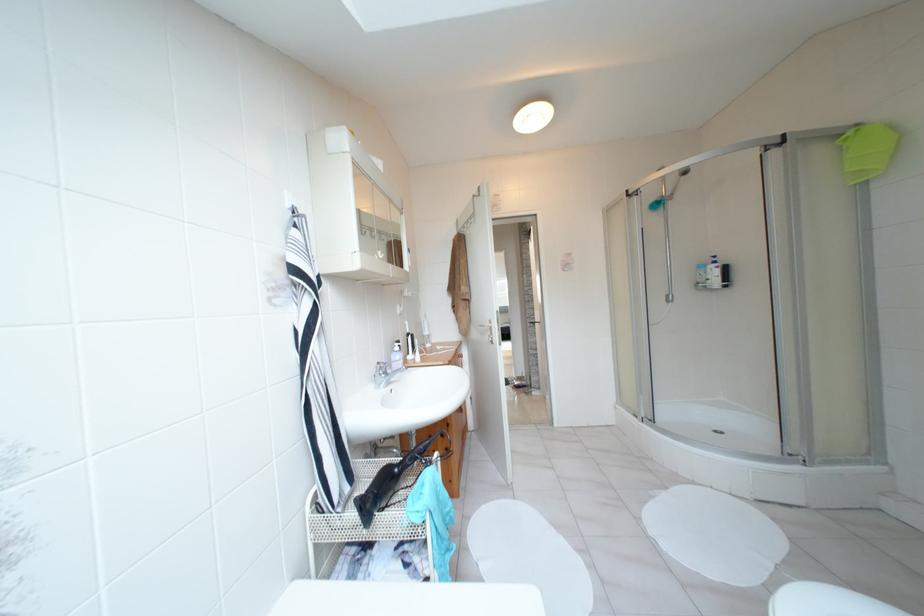
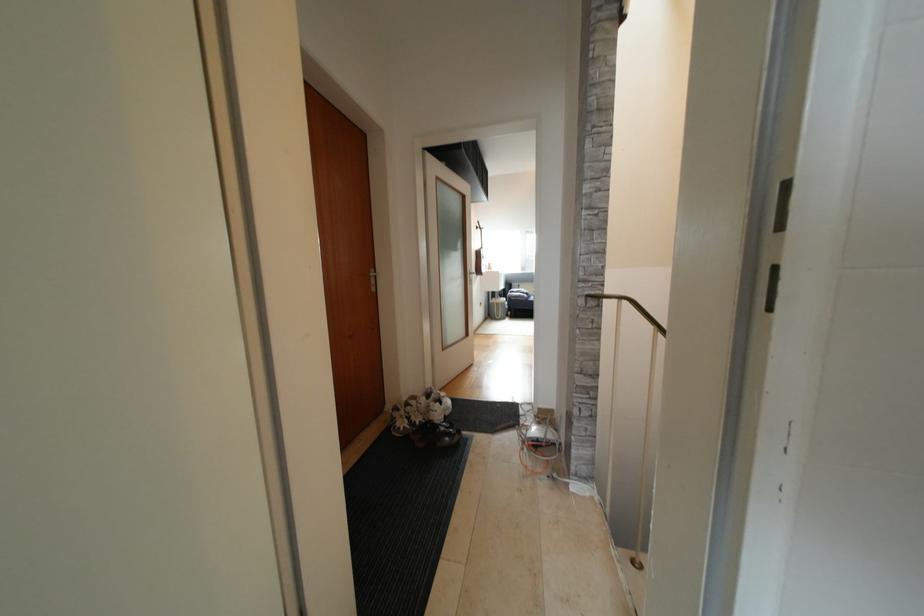
Question: In a continuous first-person perspective shot, in which direction is the camera moving?

Choices:
 (A) Left
 (B) Right
 (C) Forward
 (D) Backward

Answer: (C)